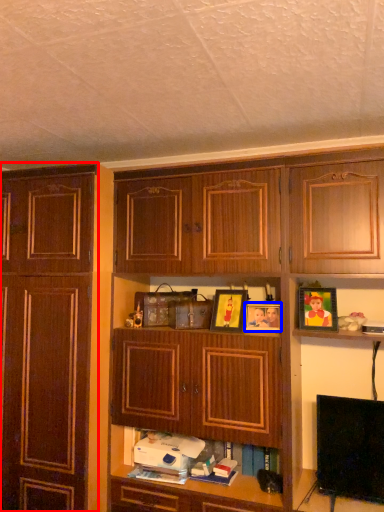
Question: Which object appears farthest to the camera in this image, cabinetry (highlighted by a red box) or picture frame (highlighted by a blue box)?

Choices:
 (A) cabinetry
 (B) picture frame

Answer: (B)